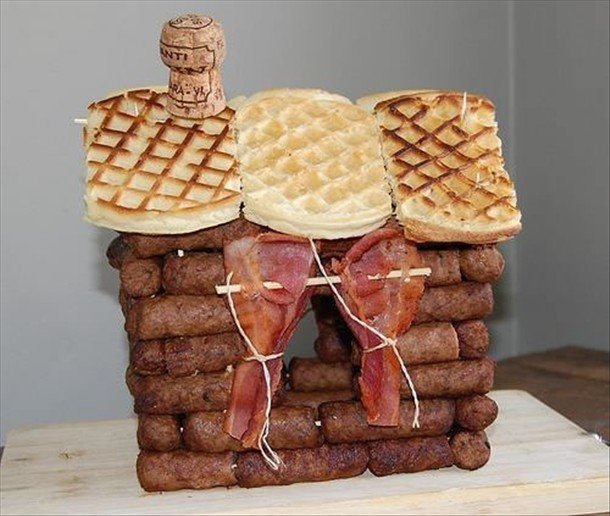
Identify the location of cork. (199, 61).